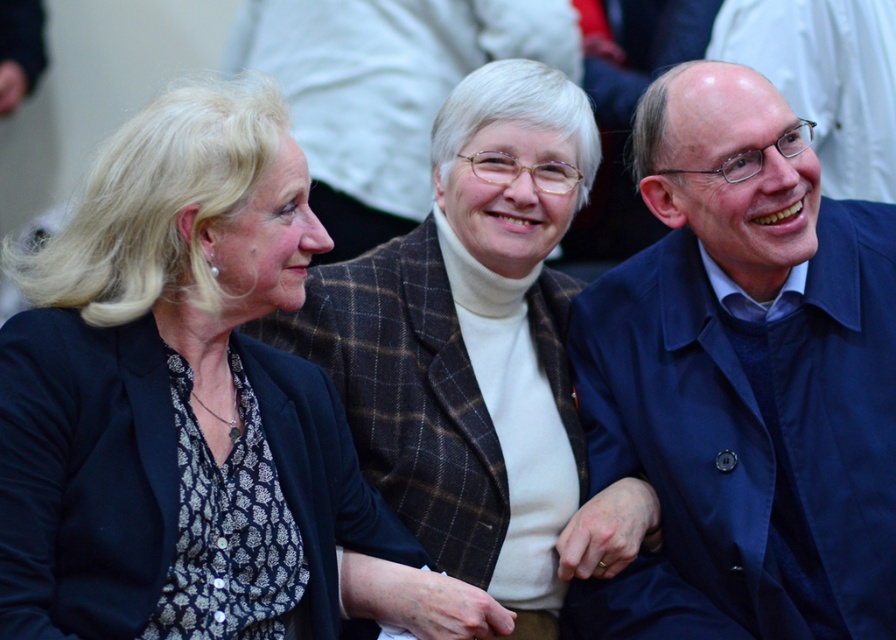
Consider the image. Based on the scene description, which object is positioned to the right of the other between the patterned fabric jacket at center and the matte black blazer at center?

The patterned fabric jacket at center is to the right of the matte black blazer at center.

You are a fashion designer observing the group. Which of the following items has a taller silhouette between the blue fabric coat at right and the matte black blazer at center?

The blue fabric coat at right has a greater height compared to the matte black blazer at center.

Consider the image. You are standing in front of a group photo of three people. The people are seated from left to right as follows. The first has a dark blazer over a patterned blouse, the second is an older woman in a brown plaid jacket over a white turtleneck, and the third is wearing a blue fabric coat at right. Based on their positions, which person is sitting closest to the right edge of the photo?

The third person, who is wearing the blue fabric coat at right, is sitting closest to the right edge of the photo because their coat is positioned at the rightmost point in the image.